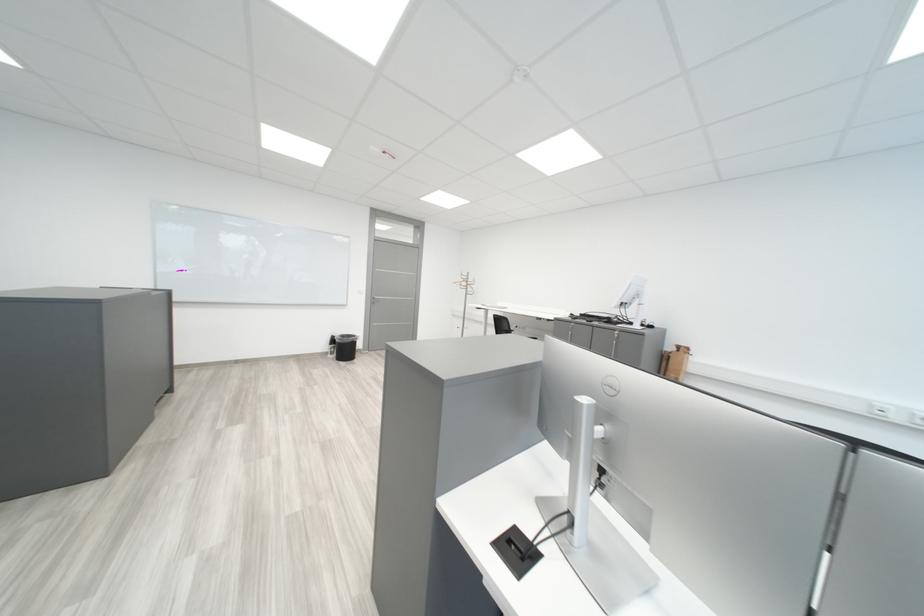
Locate an element on the screen. This screenshot has width=924, height=616. grey cabinet handle is located at coordinates (613, 344).